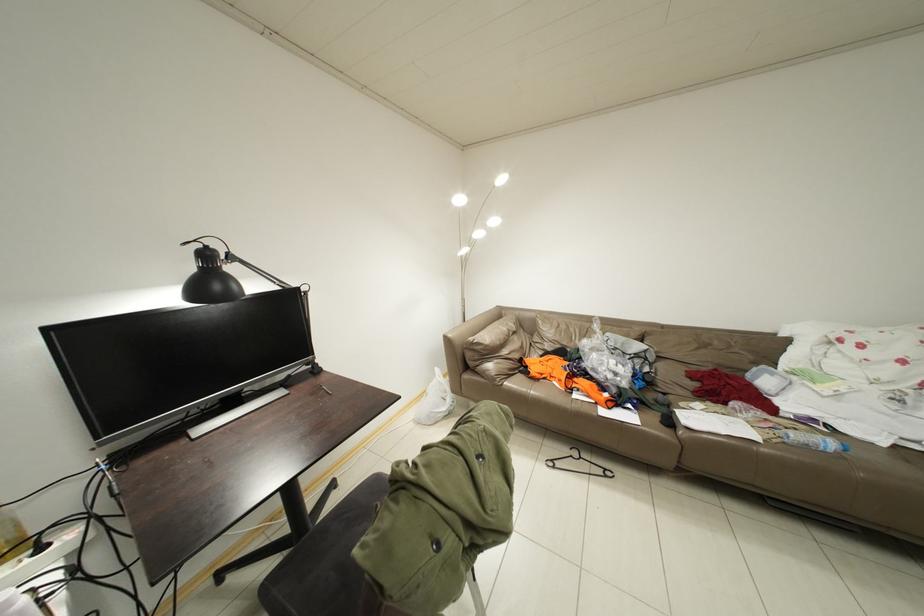
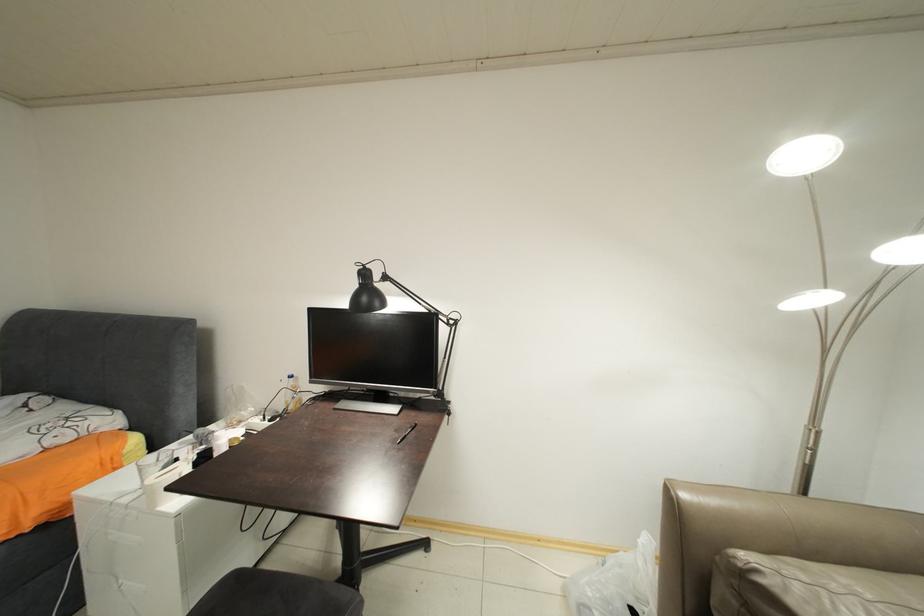
Question: The images are taken continuously from a first-person perspective. In which direction is your viewpoint rotating?

Choices:
 (A) Left
 (B) Right
 (C) Up
 (D) Down

Answer: (A)